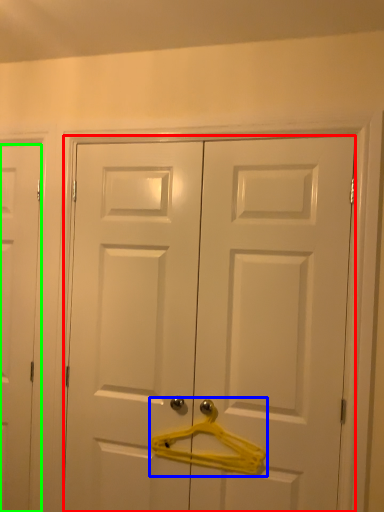
Question: Considering the real-world distances, which object is farthest from door (highlighted by a red box)? hanger (highlighted by a blue box) or door (highlighted by a green box)?

Choices:
 (A) hanger
 (B) door

Answer: (B)